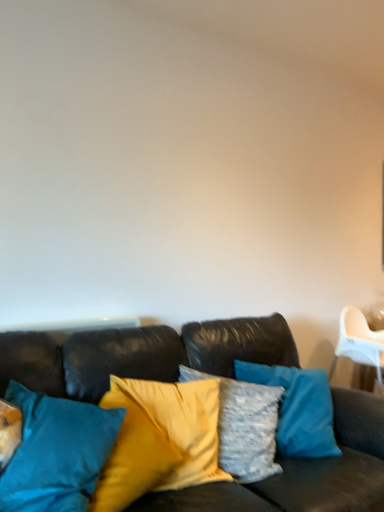
Question: Does teal fabric pillow at center, marked as the 1th pillow in a left-to-right arrangement, appear on the left side of leather couch at center?

Choices:
 (A) yes
 (B) no

Answer: (A)

Question: Does teal fabric pillow at center, marked as the 1th pillow in a left-to-right arrangement, have a lesser width compared to leather couch at center?

Choices:
 (A) yes
 (B) no

Answer: (A)

Question: Is teal fabric pillow at center, the second pillow in the right-to-left sequence, to the right of leather couch at center from the viewer's perspective?

Choices:
 (A) no
 (B) yes

Answer: (A)

Question: Is teal fabric pillow at center, the second pillow in the right-to-left sequence, positioned with its back to leather couch at center?

Choices:
 (A) yes
 (B) no

Answer: (A)

Question: Can you confirm if teal fabric pillow at center, marked as the 1th pillow in a left-to-right arrangement, is smaller than leather couch at center?

Choices:
 (A) no
 (B) yes

Answer: (B)

Question: Is teal fabric pillow at center, the second pillow in the right-to-left sequence, situated inside silky yellow pillow at center, the first pillow when ordered from right to left, or outside?

Choices:
 (A) inside
 (B) outside

Answer: (B)

Question: In terms of height, does teal fabric pillow at center, marked as the 1th pillow in a left-to-right arrangement, look taller or shorter compared to silky yellow pillow at center, the first pillow when ordered from right to left?

Choices:
 (A) tall
 (B) short

Answer: (A)

Question: Considering the positions of point (67, 445) and point (195, 458), is point (67, 445) closer or farther from the camera than point (195, 458)?

Choices:
 (A) farther
 (B) closer

Answer: (B)

Question: From a real-world perspective, is teal fabric pillow at center, the second pillow in the right-to-left sequence, physically located above or below silky yellow pillow at center, the 2th pillow when ordered from left to right?

Choices:
 (A) below
 (B) above

Answer: (B)

Question: From a real-world perspective, relative to silky yellow pillow at center, the 2th pillow when ordered from left to right, is leather couch at center vertically above or below?

Choices:
 (A) above
 (B) below

Answer: (B)

Question: Is leather couch at center taller or shorter than silky yellow pillow at center, the 2th pillow when ordered from left to right?

Choices:
 (A) short
 (B) tall

Answer: (B)

Question: Which is correct: leather couch at center is inside silky yellow pillow at center, the first pillow when ordered from right to left, or outside of it?

Choices:
 (A) outside
 (B) inside

Answer: (A)

Question: Does point (155, 330) appear closer or farther from the camera than point (175, 406)?

Choices:
 (A) closer
 (B) farther

Answer: (B)

Question: In terms of size, does teal fabric pillow at center, marked as the 1th pillow in a left-to-right arrangement, appear bigger or smaller than leather couch at center?

Choices:
 (A) small
 (B) big

Answer: (A)

Question: From a real-world perspective, relative to leather couch at center, is teal fabric pillow at center, marked as the 1th pillow in a left-to-right arrangement, vertically above or below?

Choices:
 (A) below
 (B) above

Answer: (B)